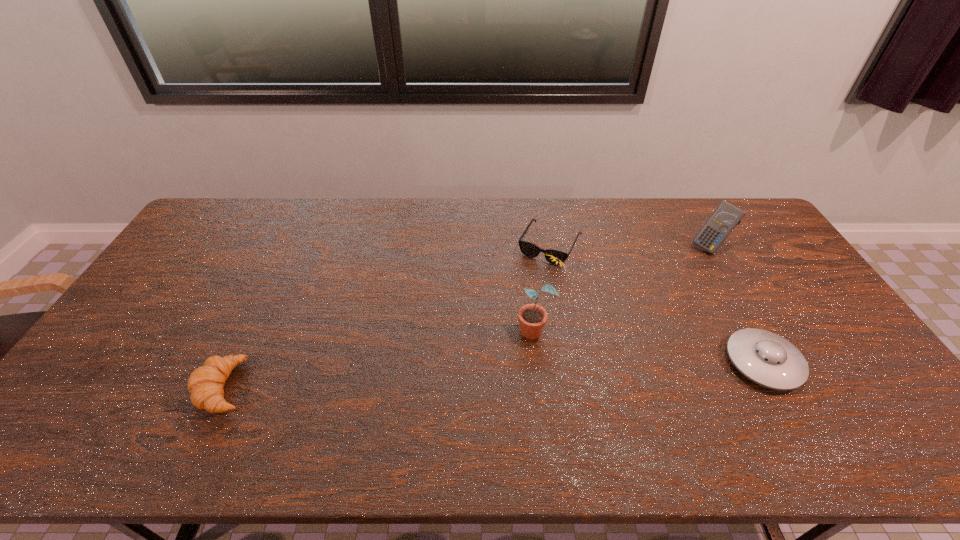
Find the location of `the leftmost object`. the leftmost object is located at coordinates (205, 384).

At what (x,y) coordinates should I click in order to perform the action: click on saucer. Please return your answer as a coordinate pair (x, y). This screenshot has height=540, width=960. Looking at the image, I should click on (766, 358).

Locate an element on the screen. The image size is (960, 540). sunglasses is located at coordinates (529, 249).

Find the location of a particular element. This screenshot has height=540, width=960. the tallest object is located at coordinates (532, 317).

Identify the location of the second tallest object. (723, 220).

In order to click on free space located on the right of the crescent roll in this screenshot , I will do `click(389, 387)`.

Where is `vacant space located 0.290m on the back of the saucer`? vacant space located 0.290m on the back of the saucer is located at coordinates (709, 264).

Find the location of a particular element. free space located at the front lenses of the sunglasses is located at coordinates pyautogui.click(x=527, y=287).

In order to click on vacant space located at the front lenses of the sunglasses in this screenshot , I will do `click(493, 346)`.

At what (x,y) coordinates should I click in order to perform the action: click on free region located at the front lenses of the sunglasses. Please return your answer as a coordinate pair (x, y). This screenshot has height=540, width=960. Looking at the image, I should click on (502, 330).